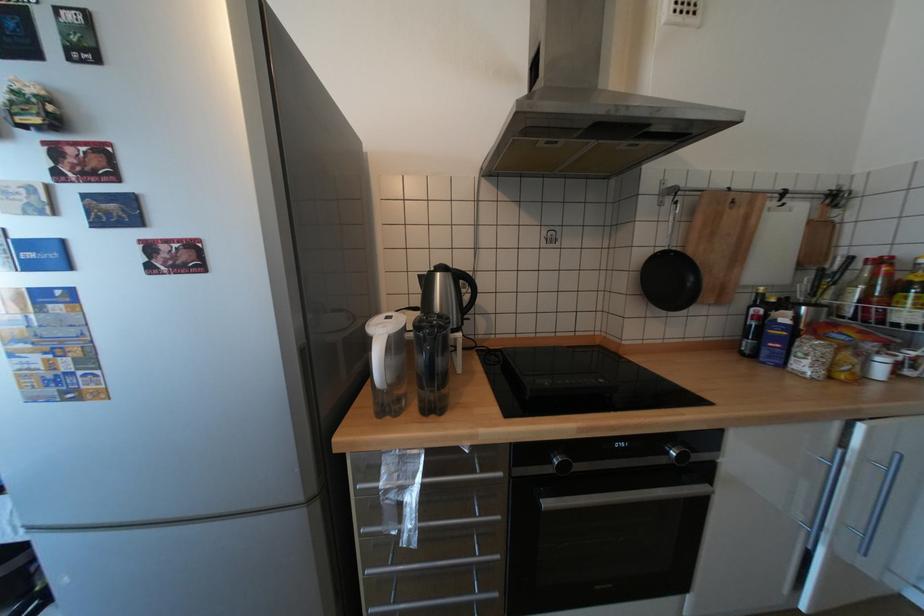
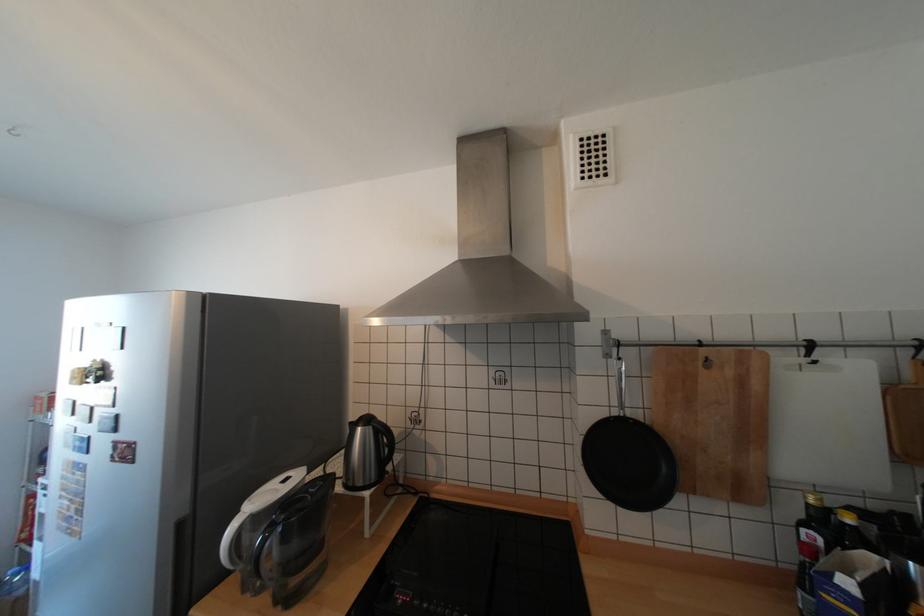
In the second image, find the point that corresponds to the point at 767,294 in the first image.

(817, 505)